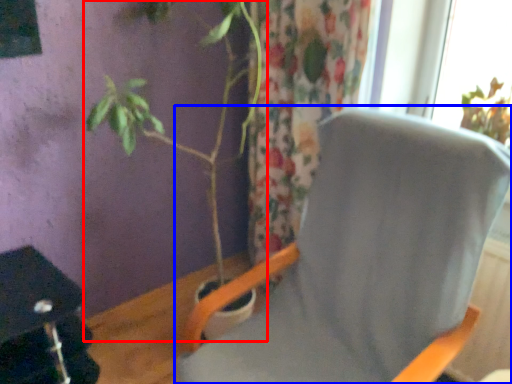
Question: Among these objects, which one is nearest to the camera, houseplant (highlighted by a red box) or chair (highlighted by a blue box)?

Choices:
 (A) houseplant
 (B) chair

Answer: (B)